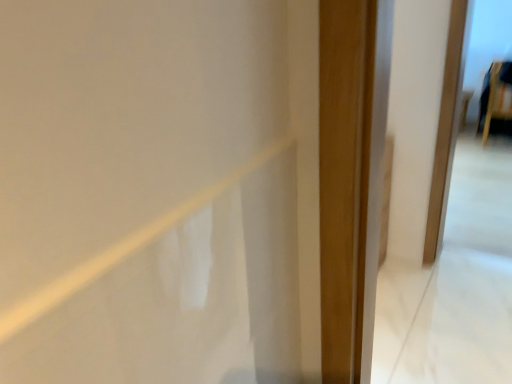
Question: Should I look upward or downward to see wooden chair at upper right?

Choices:
 (A) up
 (B) down

Answer: (A)